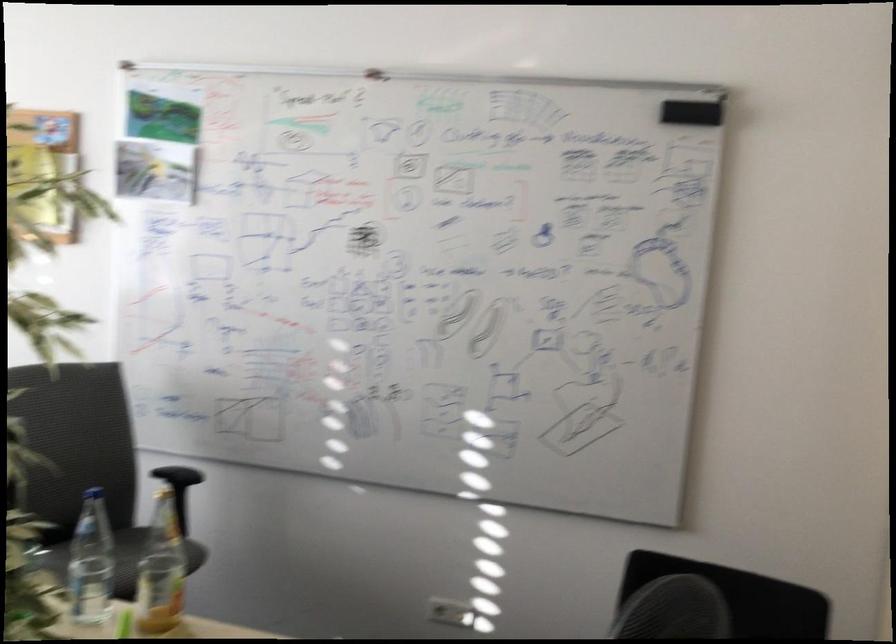
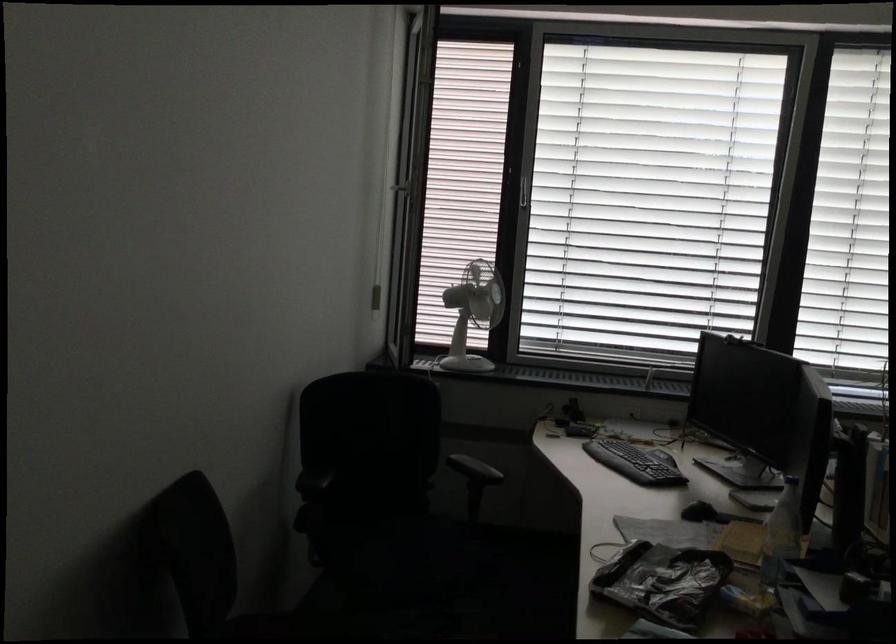
Question: How did the camera likely rotate?

Choices:
 (A) Left
 (B) Right
 (C) Up
 (D) Down

Answer: (A)